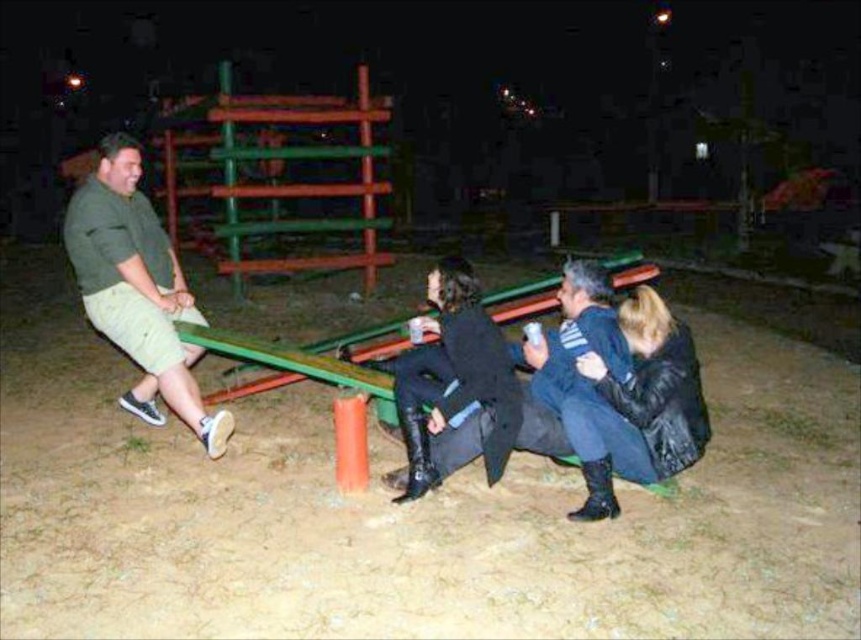
You are standing in front of the seesaw and want to place a small flag exactly at the midpoint between the two points, point (x=635, y=416) and point (x=516, y=378). Based on their positions, will the flag be closer to the camera or farther away from it compared to the two points?

The flag placed at the midpoint between point (x=635, y=416) and point (x=516, y=378) will be closer to the camera than point (x=516, y=378) but farther than point (x=635, y=416). Since the midpoint averages their distances, it would be positioned between their respective distances from the camera.

You are standing near the seesaw and notice the black leather jacket at lower right and the black leather boots at center. Which item is positioned lower in the image?

The black leather jacket at lower right is located below the black leather boots at center, so the black leather jacket at lower right is positioned lower in the image.